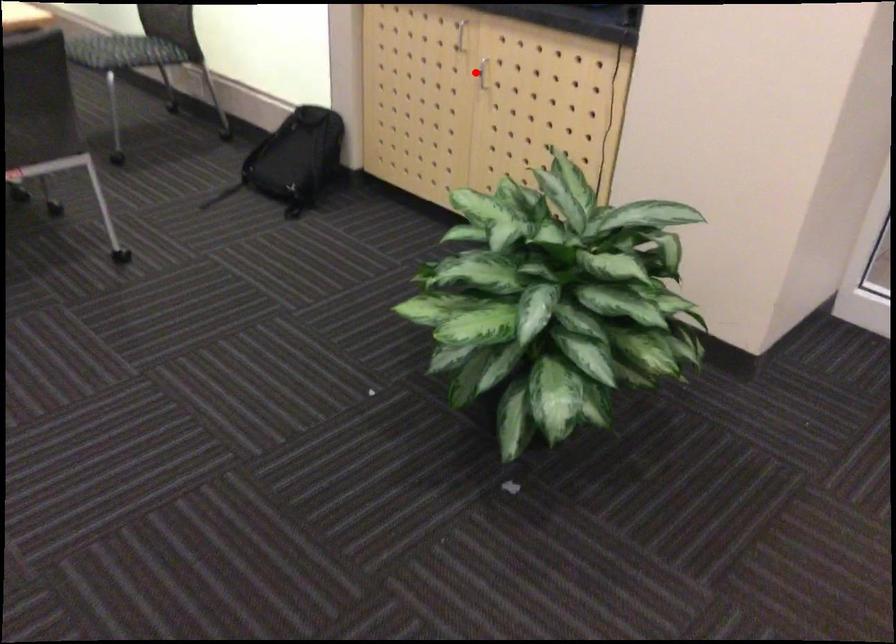
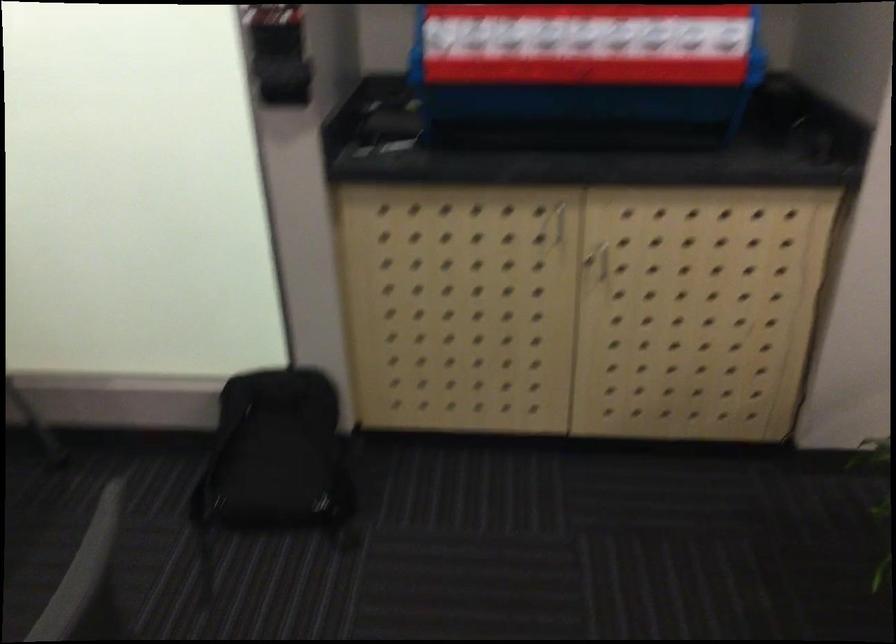
Question: I am providing you with two images of the same scene from different viewpoints. Image1 has a red point marked. In image2, the corresponding 3D location appears at what relative position? Reply with the corresponding letter.

Choices:
 (A) Closer
 (B) Farther

Answer: (A)